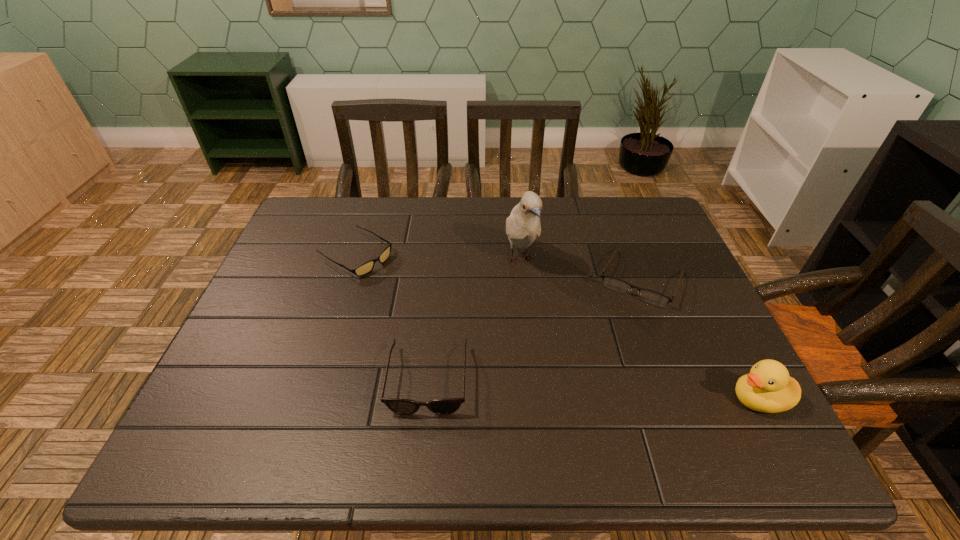
Find the location of a particular element. Image resolution: width=960 pixels, height=540 pixels. vacant space on the desktop that is between the taller sunglasses and the duckling and is positioned at the beak of the tallest object is located at coordinates (584, 389).

The image size is (960, 540). In order to click on vacant spot on the desktop that is between the taller sunglasses and the second tallest object and is positioned on the front-facing side of the farther sunglasses in this screenshot , I will do `click(584, 389)`.

The image size is (960, 540). Identify the location of vacant space on the desktop that is between the taller sunglasses and the fourth shortest object and is positioned on the front-facing side of the spectacles. (590, 389).